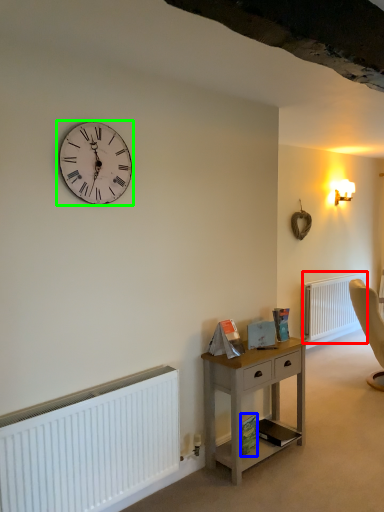
Question: Considering the real-world distances, which object is farthest from radiator (highlighted by a red box)? book (highlighted by a blue box) or wall clock (highlighted by a green box)?

Choices:
 (A) book
 (B) wall clock

Answer: (B)